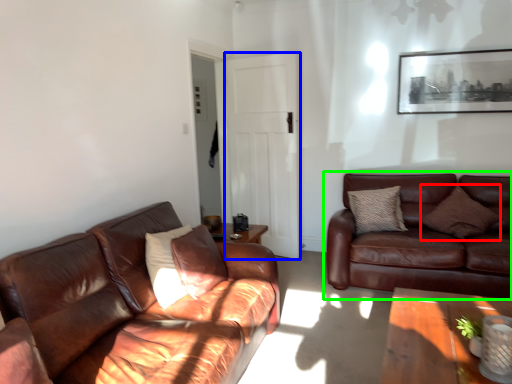
Question: Considering the real-world distances, which object is farthest from pillow (highlighted by a red box)? glass door (highlighted by a blue box) or studio couch (highlighted by a green box)?

Choices:
 (A) glass door
 (B) studio couch

Answer: (A)